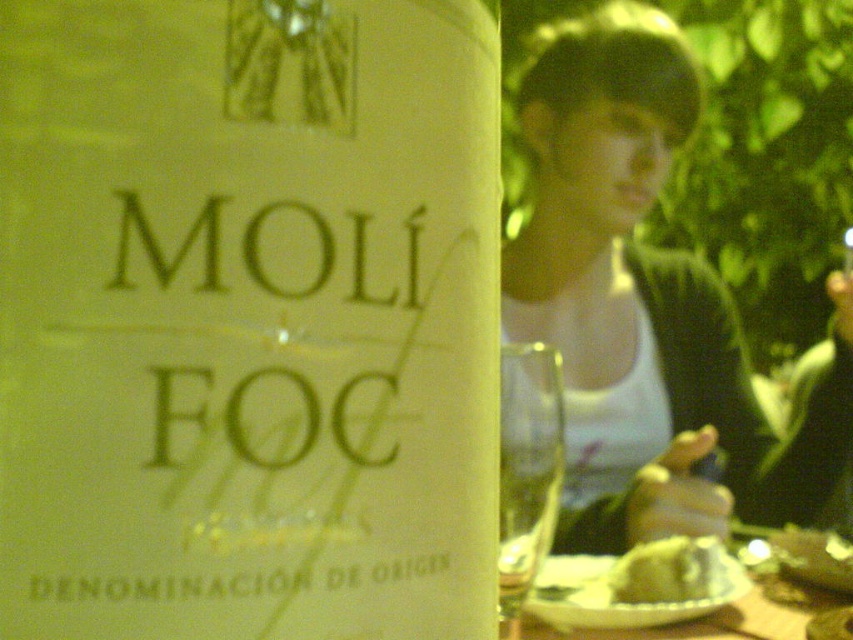
You are a waiter in a restaurant. You see a white paper bottle at center and a transparent glass wine glass at center on the table. Which object is closer to you?

The white paper bottle at center is closer to you because it is in front of the transparent glass wine glass at center.

You are standing in front of the wine bottle and want to place a small sticker exactly at the location where the white cotton tank top at upper center is shown. According to the image, what are the coordinates where you should place the sticker?

The coordinates for the white cotton tank top at upper center are at point (647, 305), so you should place the sticker at those coordinates.